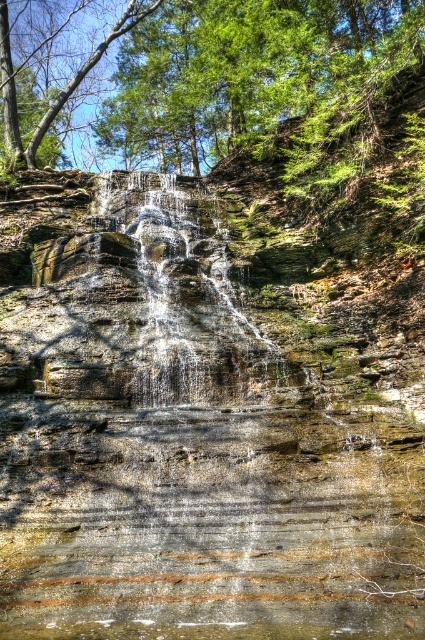
You are a bird looking for a place to perch. You see the green leafy tree at upper center and the translucent water at center. Which location would provide a wider spot for you to land?

The green leafy tree at upper center might be wider than translucent water at center, so it would provide a wider spot for landing.

You are standing at the base of the waterfall and want to reach a specific point marked at coordinates point (411,356). If you have a rope that is 15 meters long, will it be sufficient to reach that point from your current position?

The point (411,356) is 16.63 meters away from the viewer. Since the rope is only 15 meters long, it will not be sufficient to reach that point.